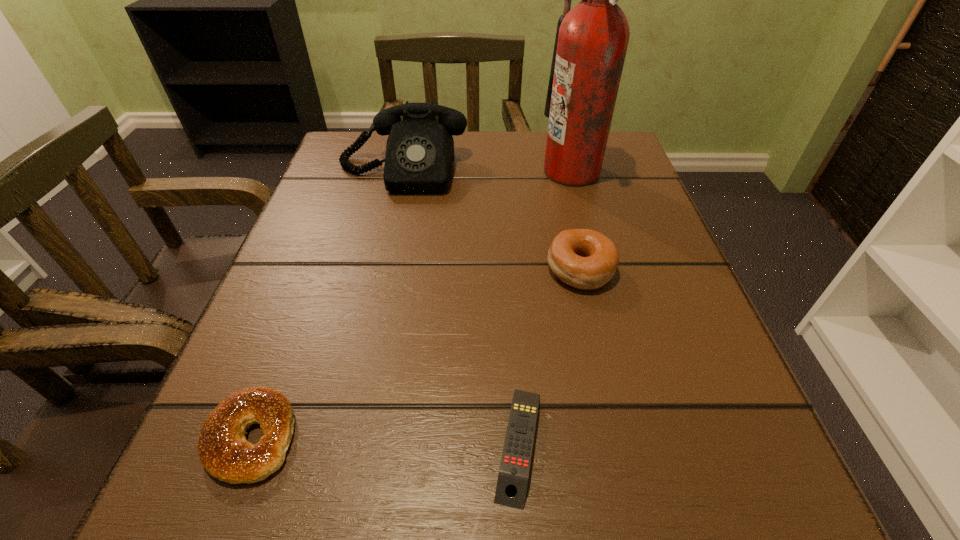
Where is `fire extinguisher`? The height and width of the screenshot is (540, 960). fire extinguisher is located at coordinates (591, 41).

Image resolution: width=960 pixels, height=540 pixels. I want to click on the fourth shortest object, so click(419, 158).

Where is `the right bagel`? The width and height of the screenshot is (960, 540). the right bagel is located at coordinates (585, 259).

Identify the location of the taller bagel. This screenshot has height=540, width=960. (585, 259).

The image size is (960, 540). In order to click on the nearer bagel in this screenshot , I will do `click(223, 450)`.

Where is `the left bagel`? The height and width of the screenshot is (540, 960). the left bagel is located at coordinates (223, 450).

Where is `the third object from right to left`? The width and height of the screenshot is (960, 540). the third object from right to left is located at coordinates (512, 482).

At what (x,y) coordinates should I click in order to perform the action: click on the shortest object. Please return your answer as a coordinate pair (x, y). The height and width of the screenshot is (540, 960). Looking at the image, I should click on (512, 482).

Locate an element on the screen. vacant region located 0.090m on the front of the fire extinguisher near the operation label is located at coordinates (501, 171).

What are the coordinates of `free spot located 0.310m on the front of the fire extinguisher near the operation label` in the screenshot? It's located at (397, 171).